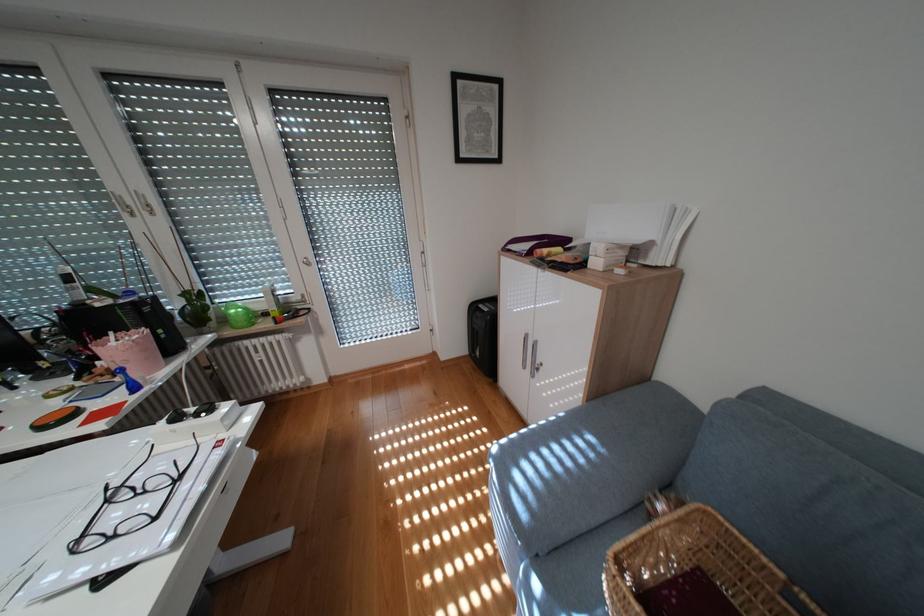
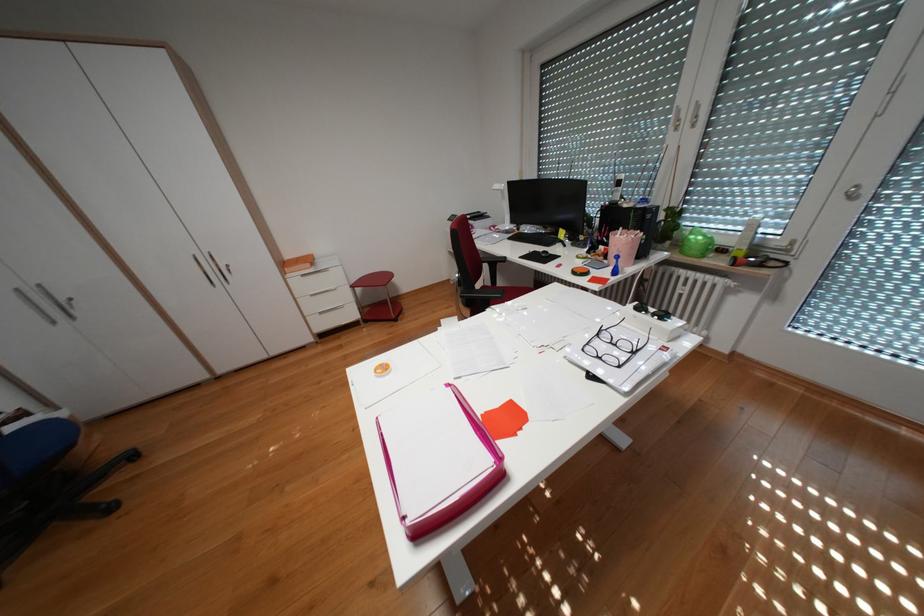
In the second image, find the point that corresponds to (314,264) in the first image.

(850, 196)